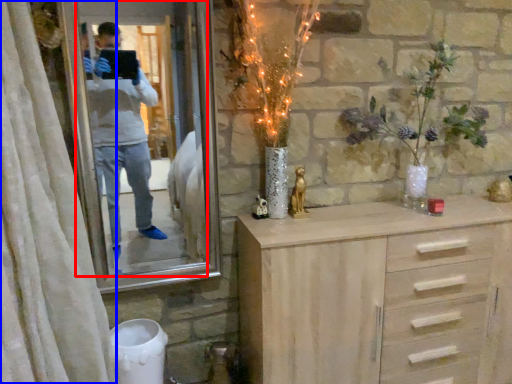
Question: Among these objects, which one is farthest to the camera, mirror (highlighted by a red box) or curtain (highlighted by a blue box)?

Choices:
 (A) mirror
 (B) curtain

Answer: (A)